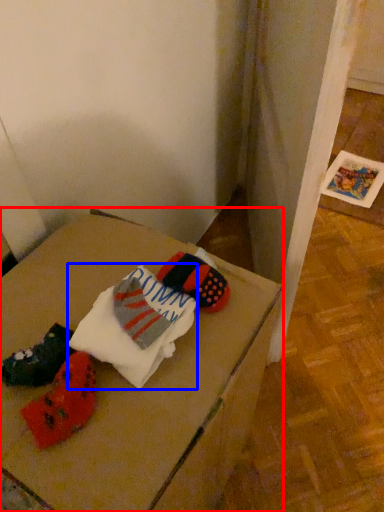
Question: Which object appears closest to the camera in this image, furniture (highlighted by a red box) or sheet (highlighted by a blue box)?

Choices:
 (A) furniture
 (B) sheet

Answer: (A)